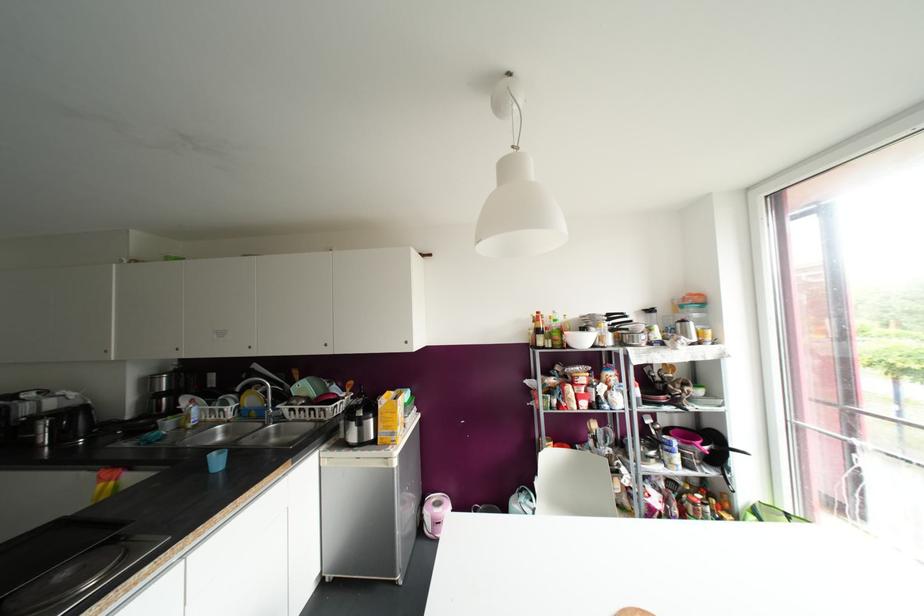
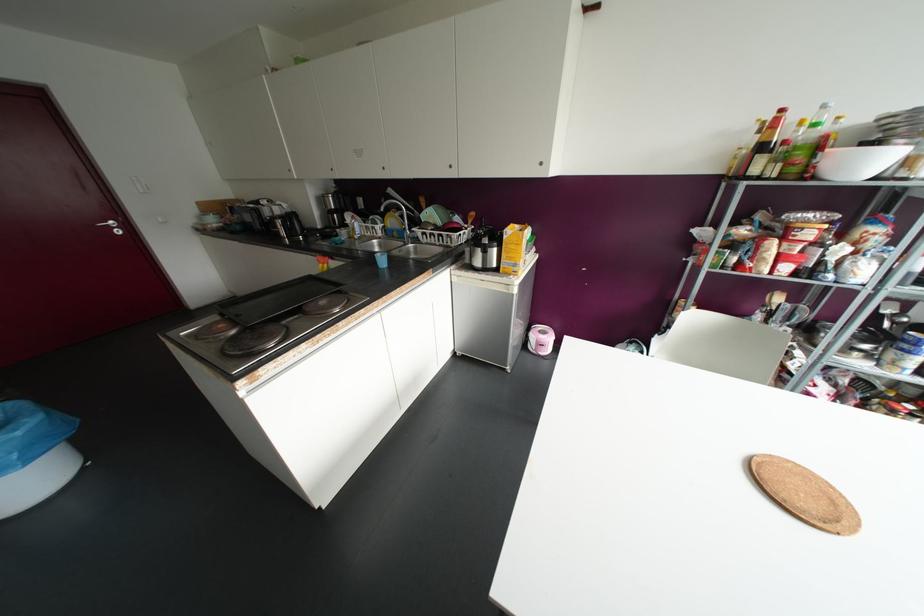
Find the pixel in the second image that matches (581,341) in the first image.

(861, 164)